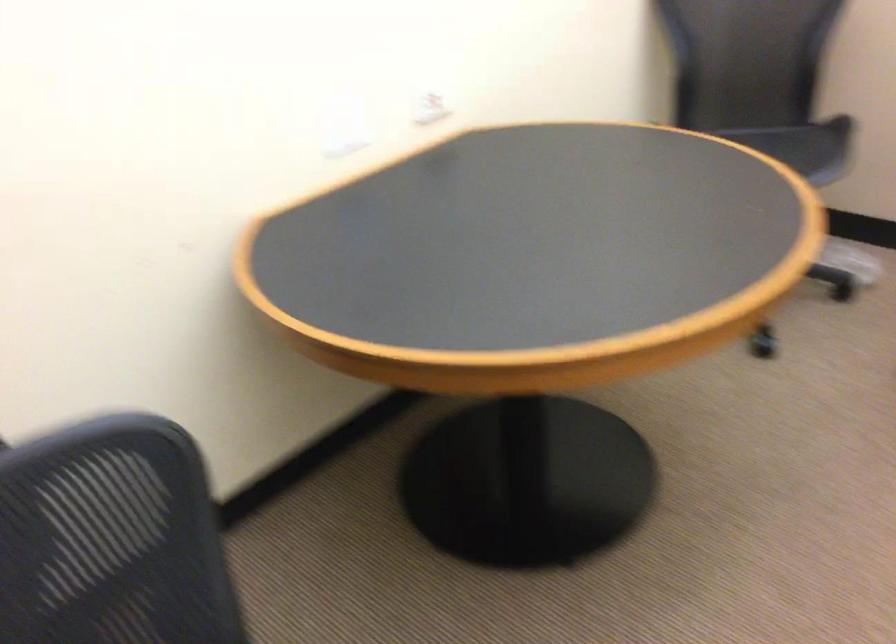
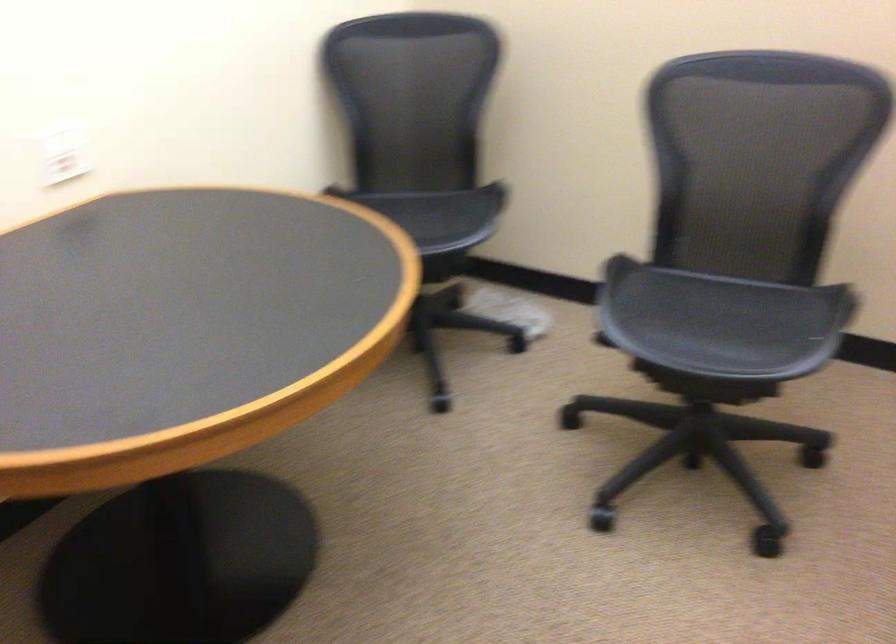
Question: What movement of the cameraman would produce the second image?

Choices:
 (A) Left
 (B) Right
 (C) Forward
 (D) Backward

Answer: (B)